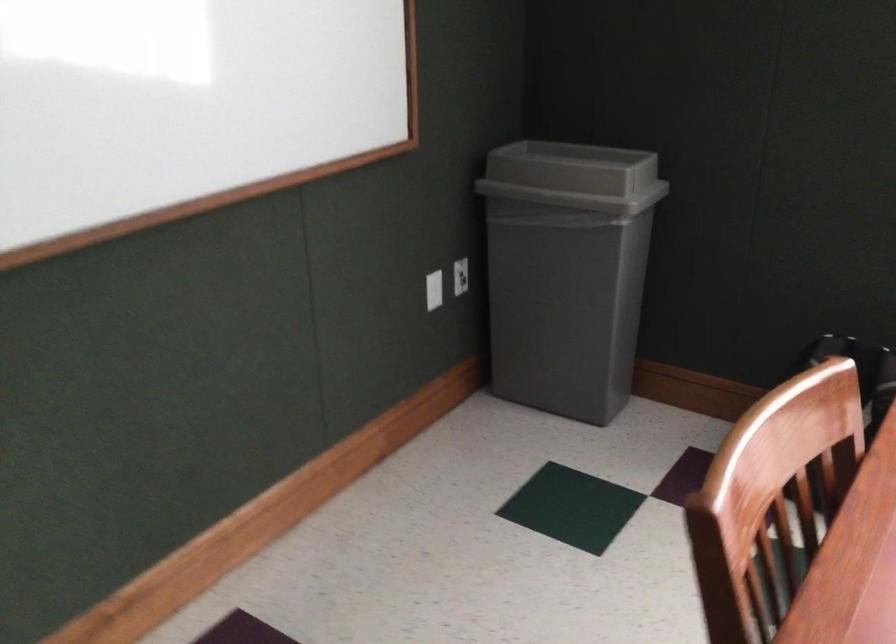
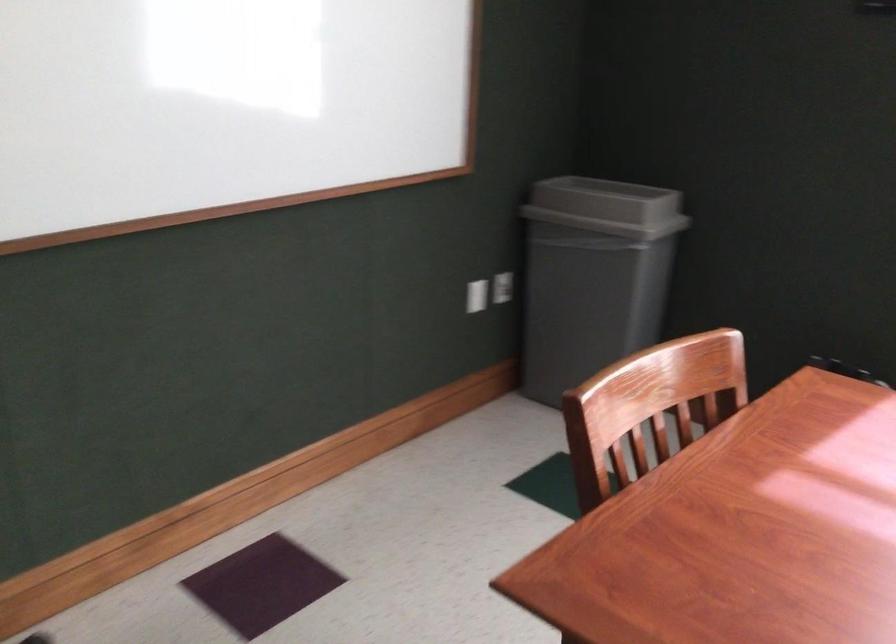
Where in the second image is the point corresponding to (462,277) from the first image?

(503, 287)